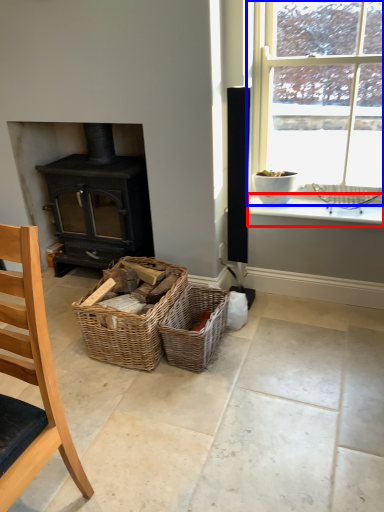
Question: Which object is further to the camera taking this photo, window sill (highlighted by a red box) or window (highlighted by a blue box)?

Choices:
 (A) window sill
 (B) window

Answer: (A)